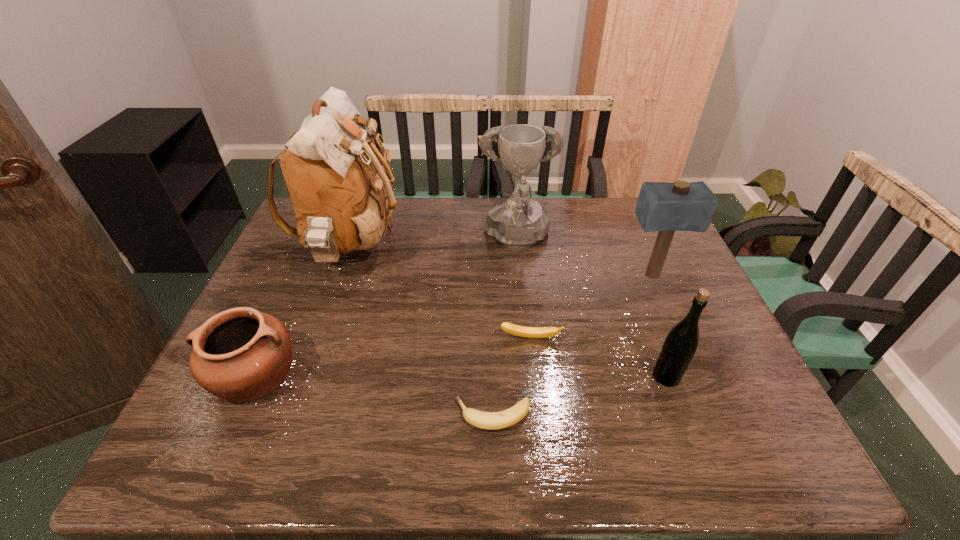
Identify the location of the tallest object. Image resolution: width=960 pixels, height=540 pixels. (342, 196).

Find the location of a particular element. the second tallest object is located at coordinates (518, 222).

Identify the location of mallet. (681, 206).

At what (x,y) coordinates should I click in order to perform the action: click on beer bottle. Please return your answer as a coordinate pair (x, y). Looking at the image, I should click on (680, 345).

Identify the location of pottery. (239, 355).

At what (x,y) coordinates should I click in order to perform the action: click on the farther banana. Please return your answer as a coordinate pair (x, y). Looking at the image, I should click on (528, 332).

Identify the location of the sixth tallest object. This screenshot has height=540, width=960. (528, 332).

Locate an element on the screen. the nearer banana is located at coordinates (485, 420).

Identify the location of the shortest object. This screenshot has width=960, height=540. (485, 420).

The width and height of the screenshot is (960, 540). In order to click on vacant point located on the front-facing side of the backpack in this screenshot , I will do `click(506, 248)`.